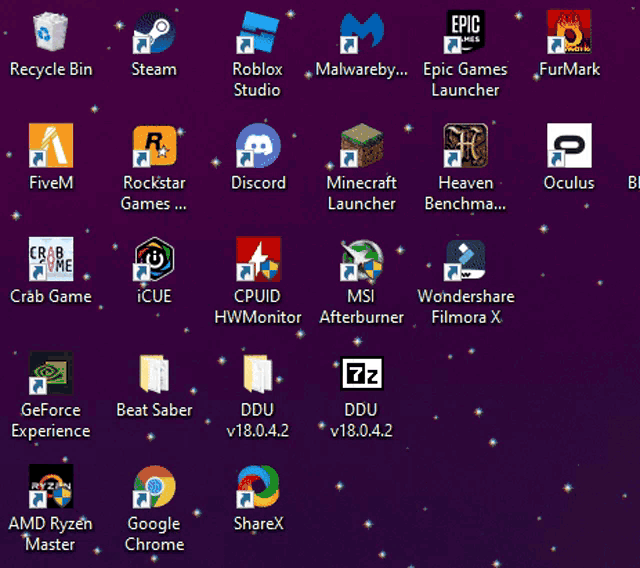
The width and height of the screenshot is (640, 568). In order to click on documents in this screenshot , I will do `click(207, 183)`.